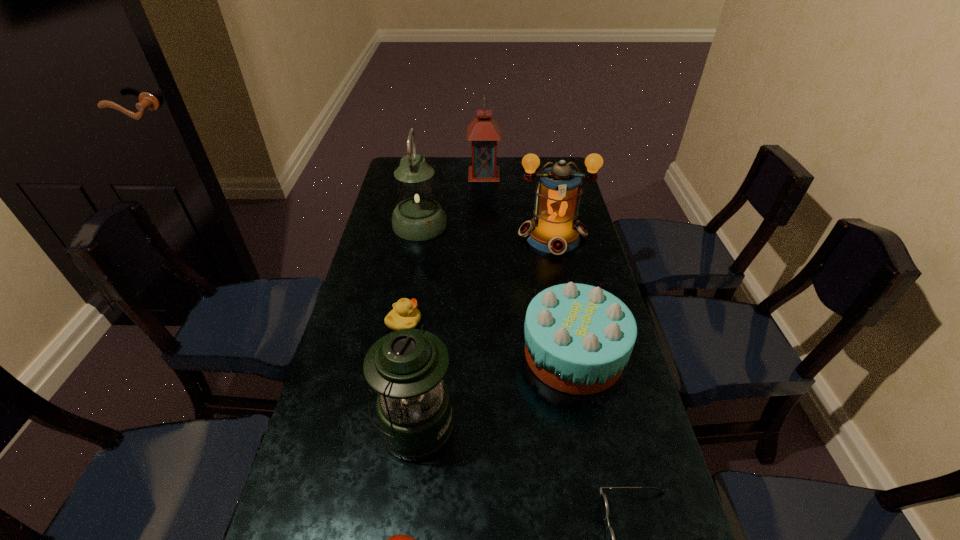
Identify the location of free space that is in between the duckling and the rightmost lantern. The height and width of the screenshot is (540, 960). (478, 279).

In order to click on the sixth closest object to the nearest lantern in this screenshot , I will do `click(418, 216)`.

Identify the location of object that is the fifth closest to the rightmost lantern. (406, 368).

Identify which lantern is the second closest to the third shortest object. Please provide its 2D coordinates. Your answer should be formatted as a tuple, i.e. [(x, y)], where the tuple contains the x and y coordinates of a point satisfying the conditions above.

[(554, 229)]

Where is `lantern that stands as the third closest to the sixth tallest object`? This screenshot has height=540, width=960. lantern that stands as the third closest to the sixth tallest object is located at coordinates (418, 216).

You are a GUI agent. You are given a task and a screenshot of the screen. Output one action in this format:
    pyautogui.click(x=<x>, y=<y>)
    Task: Click on the vacant space that satisfies the following two spatial constraints: 1. on the beak of the duckling; 2. on the back side of the nearest lantern
    
    Given the screenshot: What is the action you would take?
    pyautogui.click(x=386, y=426)

Locate an element on the screen. This screenshot has height=540, width=960. free location that satisfies the following two spatial constraints: 1. on the back side of the nearest lantern; 2. on the beak of the second shortest object is located at coordinates (426, 322).